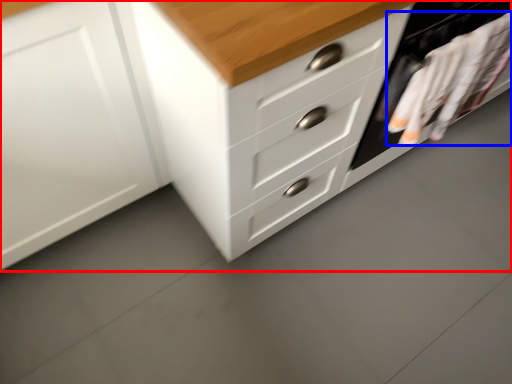
Question: Which object is further to the camera taking this photo, chest of drawers (highlighted by a red box) or laundry (highlighted by a blue box)?

Choices:
 (A) chest of drawers
 (B) laundry

Answer: (B)